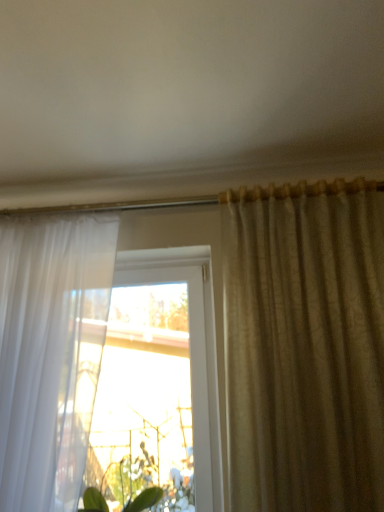
You are a GUI agent. You are given a task and a screenshot of the screen. Output one action in this format:
    pyautogui.click(x=<x>, y=<y>)
    Task: Click on the satin beige curtain at right, acting as the second curtain starting from the left
    
    Given the screenshot: What is the action you would take?
    pyautogui.click(x=305, y=346)

Can you confirm if green leafy plant at lower center is wider than satin beige curtain at right, acting as the second curtain starting from the left?

Incorrect, the width of green leafy plant at lower center does not surpass that of satin beige curtain at right, acting as the second curtain starting from the left.

From a real-world perspective, is green leafy plant at lower center positioned over satin beige curtain at right, acting as the second curtain starting from the left, based on gravity?

No, from a real-world perspective, green leafy plant at lower center is not above satin beige curtain at right, acting as the second curtain starting from the left.

Where is `the 2nd curtain in front of the green leafy plant at lower center, counting from the anchor's position`? The image size is (384, 512). the 2nd curtain in front of the green leafy plant at lower center, counting from the anchor's position is located at coordinates (305, 346).

Is point (182, 490) closer or farther from the camera than point (294, 487)?

Point (182, 490).

Which is less distant, (6, 310) or (147, 450)?

Point (6, 310) is positioned closer to the camera compared to point (147, 450).

Which is behind, white sheer curtain at left, the first curtain in the left-to-right sequence, or transparent glass window at center?

transparent glass window at center is behind.

Is white sheer curtain at left, which is counted as the second curtain, starting from the right, oriented towards transparent glass window at center?

No, white sheer curtain at left, which is counted as the second curtain, starting from the right, does not turn towards transparent glass window at center.

Is white sheer curtain at left, which is counted as the second curtain, starting from the right, directly adjacent to transparent glass window at center?

No, white sheer curtain at left, which is counted as the second curtain, starting from the right, is not touching transparent glass window at center.

Where is `vegetation behind the satin beige curtain at right, the 1th curtain positioned from the right`? vegetation behind the satin beige curtain at right, the 1th curtain positioned from the right is located at coordinates (138, 490).

Is satin beige curtain at right, acting as the second curtain starting from the left, at the right side of green leafy plant at lower center?

Correct, you'll find satin beige curtain at right, acting as the second curtain starting from the left, to the right of green leafy plant at lower center.

Would you say satin beige curtain at right, acting as the second curtain starting from the left, is inside or outside green leafy plant at lower center?

satin beige curtain at right, acting as the second curtain starting from the left, exists outside the volume of green leafy plant at lower center.

Considering the points (276, 361) and (86, 501), which point is behind, point (276, 361) or point (86, 501)?

Point (86, 501)

Is transparent glass window at center aimed at green leafy plant at lower center?

Yes, transparent glass window at center is oriented towards green leafy plant at lower center.

Considering the relative positions of transparent glass window at center and green leafy plant at lower center in the image provided, is transparent glass window at center in front of green leafy plant at lower center?

No, it is behind green leafy plant at lower center.

Is point (123, 467) in front of point (93, 475)?

That is True.

Considering the relative positions of transparent glass window at center and green leafy plant at lower center in the image provided, is transparent glass window at center to the left of green leafy plant at lower center from the viewer's perspective?

No.

Does point (39, 326) appear closer or farther from the camera than point (151, 490)?

Point (39, 326).

Can you confirm if white sheer curtain at left, the first curtain in the left-to-right sequence, is taller than green leafy plant at lower center?

Correct, white sheer curtain at left, the first curtain in the left-to-right sequence, is much taller as green leafy plant at lower center.

From the image's perspective, is satin beige curtain at right, acting as the second curtain starting from the left, beneath white sheer curtain at left, the first curtain in the left-to-right sequence?

Actually, satin beige curtain at right, acting as the second curtain starting from the left, appears above white sheer curtain at left, the first curtain in the left-to-right sequence, in the image.

Based on the photo, would you say white sheer curtain at left, which is counted as the second curtain, starting from the right, is part of satin beige curtain at right, the 1th curtain positioned from the right,'s contents?

No, white sheer curtain at left, which is counted as the second curtain, starting from the right, is not surrounded by satin beige curtain at right, the 1th curtain positioned from the right.

Based on the photo, is satin beige curtain at right, the 1th curtain positioned from the right, taller or shorter than white sheer curtain at left, which is counted as the second curtain, starting from the right?

In the image, satin beige curtain at right, the 1th curtain positioned from the right, appears to be taller than white sheer curtain at left, which is counted as the second curtain, starting from the right.

Is satin beige curtain at right, the 1th curtain positioned from the right, facing towards white sheer curtain at left, the first curtain in the left-to-right sequence?

No.

How much distance is there between green leafy plant at lower center and transparent glass window at center?

The distance of green leafy plant at lower center from transparent glass window at center is 11.60 inches.

What's the angular difference between green leafy plant at lower center and transparent glass window at center's facing directions?

They differ by 0.000199 degrees in their facing directions.

Considering the relative positions of green leafy plant at lower center and transparent glass window at center in the image provided, is green leafy plant at lower center to the left or to the right of transparent glass window at center?

From the image, it's evident that green leafy plant at lower center is to the left of transparent glass window at center.

Is green leafy plant at lower center outside of transparent glass window at center?

green leafy plant at lower center lies outside transparent glass window at center's area.

From the image's perspective, which curtain is the 2nd one above the green leafy plant at lower center? Please provide its 2D coordinates.

[(305, 346)]

Starting from the transparent glass window at center, which curtain is the 1st one in front? Please provide its 2D coordinates.

[(50, 353)]

Based on their spatial positions, is transparent glass window at center or green leafy plant at lower center closer to satin beige curtain at right, the 1th curtain positioned from the right?

transparent glass window at center lies closer to satin beige curtain at right, the 1th curtain positioned from the right, than the other object.

Considering their positions, is white sheer curtain at left, the first curtain in the left-to-right sequence, positioned further to transparent glass window at center than green leafy plant at lower center?

white sheer curtain at left, the first curtain in the left-to-right sequence, is positioned further to the anchor transparent glass window at center.

Based on their spatial positions, is satin beige curtain at right, the 1th curtain positioned from the right, or transparent glass window at center further from white sheer curtain at left, which is counted as the second curtain, starting from the right?

satin beige curtain at right, the 1th curtain positioned from the right.

Looking at the image, which one is located further to green leafy plant at lower center, transparent glass window at center or white sheer curtain at left, the first curtain in the left-to-right sequence?

Among the two, white sheer curtain at left, the first curtain in the left-to-right sequence, is located further to green leafy plant at lower center.

Looking at the image, which one is located further to white sheer curtain at left, which is counted as the second curtain, starting from the right, transparent glass window at center or satin beige curtain at right, the 1th curtain positioned from the right?

satin beige curtain at right, the 1th curtain positioned from the right.

Consider the image. Considering their positions, is white sheer curtain at left, which is counted as the second curtain, starting from the right, positioned further to satin beige curtain at right, the 1th curtain positioned from the right, than transparent glass window at center?

white sheer curtain at left, which is counted as the second curtain, starting from the right, is further to satin beige curtain at right, the 1th curtain positioned from the right.

Based on their spatial positions, is green leafy plant at lower center or white sheer curtain at left, which is counted as the second curtain, starting from the right, further from satin beige curtain at right, the 1th curtain positioned from the right?

The object further to satin beige curtain at right, the 1th curtain positioned from the right, is green leafy plant at lower center.

Which object lies further to the anchor point green leafy plant at lower center, satin beige curtain at right, acting as the second curtain starting from the left, or white sheer curtain at left, which is counted as the second curtain, starting from the right?

satin beige curtain at right, acting as the second curtain starting from the left, is further to green leafy plant at lower center.

Find the location of a particular element. This screenshot has width=384, height=512. vegetation located between white sheer curtain at left, the first curtain in the left-to-right sequence, and satin beige curtain at right, acting as the second curtain starting from the left, in the left-right direction is located at coordinates click(x=138, y=490).

Locate an element on the screen. This screenshot has width=384, height=512. window situated between green leafy plant at lower center and satin beige curtain at right, the 1th curtain positioned from the right, from left to right is located at coordinates (157, 379).

Find the location of a particular element. window situated between white sheer curtain at left, which is counted as the second curtain, starting from the right, and satin beige curtain at right, the 1th curtain positioned from the right, from left to right is located at coordinates (157, 379).

What are the coordinates of `window between white sheer curtain at left, which is counted as the second curtain, starting from the right, and green leafy plant at lower center in the up-down direction` in the screenshot? It's located at (157, 379).